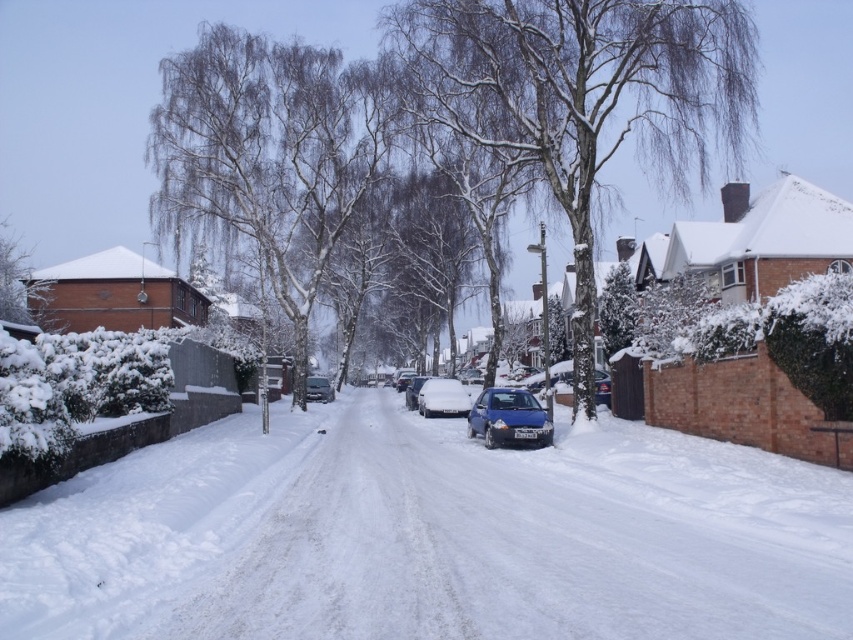
Question: Based on their relative distances, which object is farther from the blue metallic car at center?

Choices:
 (A) matte black van at center
 (B) white fluffy snow at center

Answer: (B)

Question: Which point appears farthest from the camera in this image?

Choices:
 (A) (480, 429)
 (B) (328, 384)
 (C) (408, 404)
 (D) (392, 488)

Answer: (B)

Question: Does white fluffy snow at center appear on the right side of blue metallic car at center?

Choices:
 (A) yes
 (B) no

Answer: (A)

Question: Is the position of snow-covered bark tree at center less distant than that of matte black van at center?

Choices:
 (A) yes
 (B) no

Answer: (A)

Question: Does matte black van at center come in front of blue metallic car at center?

Choices:
 (A) no
 (B) yes

Answer: (B)

Question: Which of these objects is positioned closest to the metallic blue hatchback at center?

Choices:
 (A) white snow-covered tree at upper left
 (B) snow-covered tree at left
 (C) snow-covered blue car at center
 (D) white fluffy snow at center

Answer: (D)